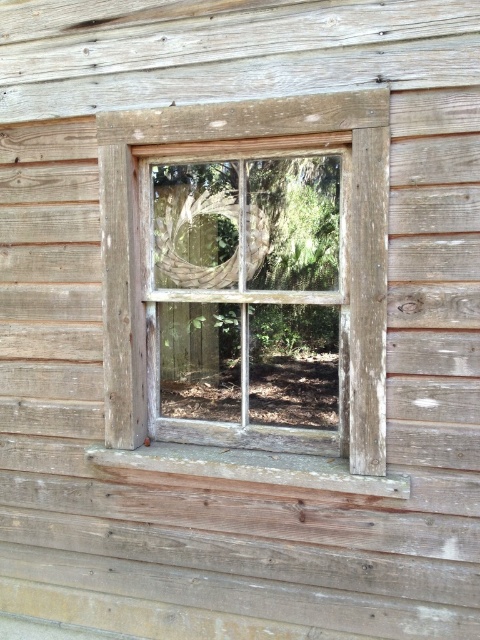
You are an interior designer assessing the rustic wooden wall. You notice the weathered wood window at center and the weathered wood at bottom. Which object is closer to you as you face the wall?

The weathered wood window at center is closer to you than the weathered wood at bottom because it is in front of it.

You are standing in front of a rustic wooden wall with a window. There is a point marked at coordinates (247, 288). What object is located at that point?

The point at coordinates (247, 288) corresponds to the weathered wood window at center.

You are an interior designer assessing the rustic wooden wall. You need to determine if the weathered wood window at center can fit horizontally within the width of the weathered wood at bottom. Based on the scene, what is your conclusion?

The weathered wood window at center has a width less than the weathered wood at bottom, so it can fit horizontally within the width of the weathered wood at bottom.